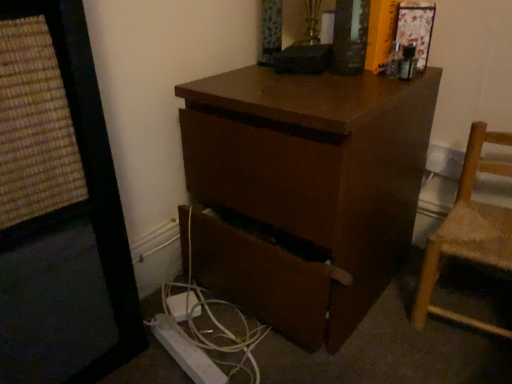
Where is `vacant region above brown matte desk at center (from a real-world perspective)`? The image size is (512, 384). vacant region above brown matte desk at center (from a real-world perspective) is located at coordinates (308, 81).